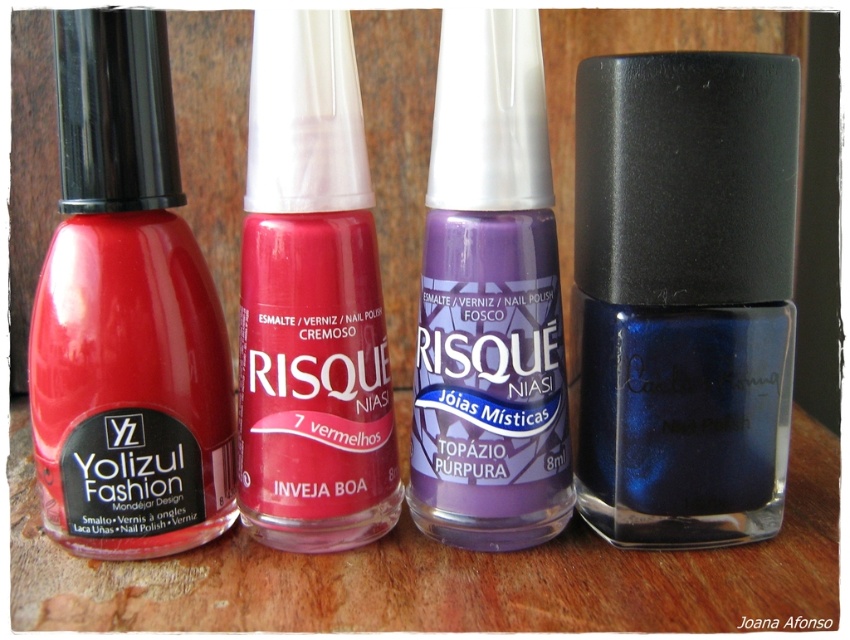
Question: Which point is farther to the camera?

Choices:
 (A) matte red nail polish at center
 (B) matte glass nail polish at left
 (C) glossy blue nail polish at right
 (D) transparent glass bottles at center

Answer: (A)

Question: Does matte red nail polish at center appear on the right side of frosted purple nail polish at center?

Choices:
 (A) yes
 (B) no

Answer: (B)

Question: Which object is the closest to the matte glass nail polish at left?

Choices:
 (A) frosted purple nail polish at center
 (B) transparent glass bottles at center

Answer: (B)

Question: Is glossy blue nail polish at right positioned behind matte glass nail polish at left?

Choices:
 (A) yes
 (B) no

Answer: (B)

Question: Among these points, which one is nearest to the camera?

Choices:
 (A) (704, 449)
 (B) (350, 320)
 (C) (650, 572)

Answer: (A)

Question: Is glossy blue nail polish at right to the right of matte glass nail polish at left from the viewer's perspective?

Choices:
 (A) no
 (B) yes

Answer: (B)